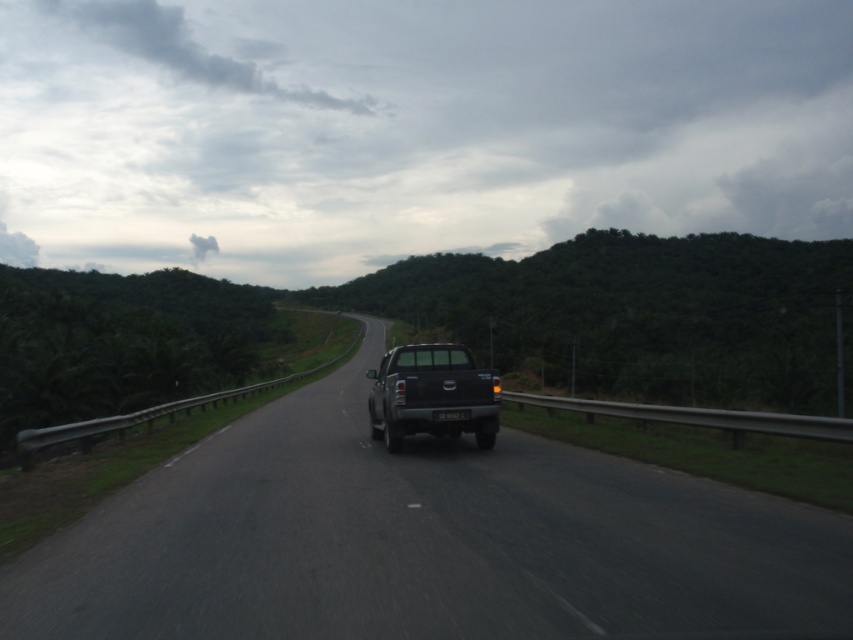
How much distance is there between black matte truck at center and matte black truck at center?

black matte truck at center and matte black truck at center are 3.54 meters apart.

Who is taller, black matte truck at center or matte black truck at center?

With more height is matte black truck at center.

Does point (107, 508) lie in front of point (401, 419)?

Yes, it is in front of point (401, 419).

Find the location of a particular element. The width and height of the screenshot is (853, 640). black matte truck at center is located at coordinates (424, 541).